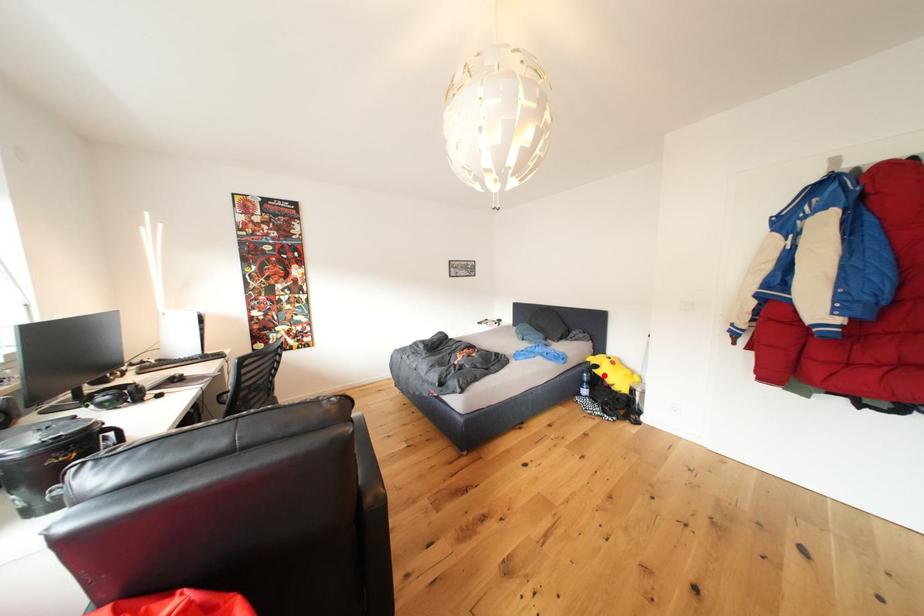
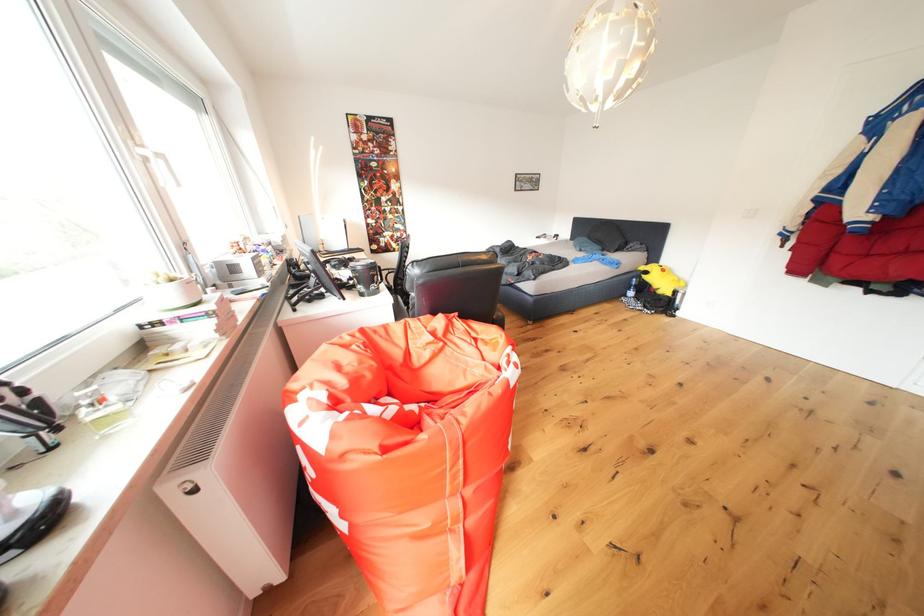
Question: I am providing you with two images of the same scene from different viewpoints. Image1 has a red point marked. In image2, the corresponding 3D location appears at what relative position? Reply with the corresponding letter.

Choices:
 (A) Closer
 (B) Farther

Answer: (A)